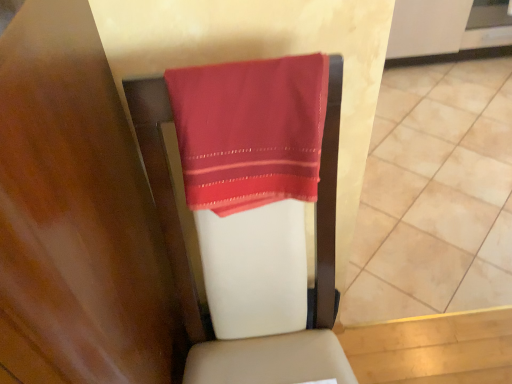
Question: Considering the positions of matte red towel at center and satin red towel at center in the image, is matte red towel at center wider or thinner than satin red towel at center?

Choices:
 (A) wide
 (B) thin

Answer: (A)

Question: In the image, is matte red towel at center positioned in front of or behind satin red towel at center?

Choices:
 (A) front
 (B) behind

Answer: (B)

Question: Considering the positions of matte red towel at center and satin red towel at center in the image, is matte red towel at center taller or shorter than satin red towel at center?

Choices:
 (A) tall
 (B) short

Answer: (B)

Question: Is point (298, 64) positioned closer to the camera than point (385, 182)?

Choices:
 (A) closer
 (B) farther

Answer: (A)

Question: Is satin red towel at center taller or shorter than matte red towel at center?

Choices:
 (A) tall
 (B) short

Answer: (A)

Question: From the image's perspective, relative to matte red towel at center, is satin red towel at center above or below?

Choices:
 (A) below
 (B) above

Answer: (A)

Question: Looking at their shapes, would you say satin red towel at center is wider or thinner than matte red towel at center?

Choices:
 (A) wide
 (B) thin

Answer: (B)